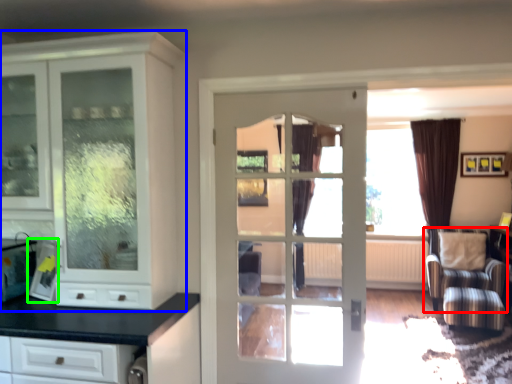
Question: Considering the real-world distances, which object is farthest from chair (highlighted by a red box)? cabinetry (highlighted by a blue box) or appliance (highlighted by a green box)?

Choices:
 (A) cabinetry
 (B) appliance

Answer: (B)